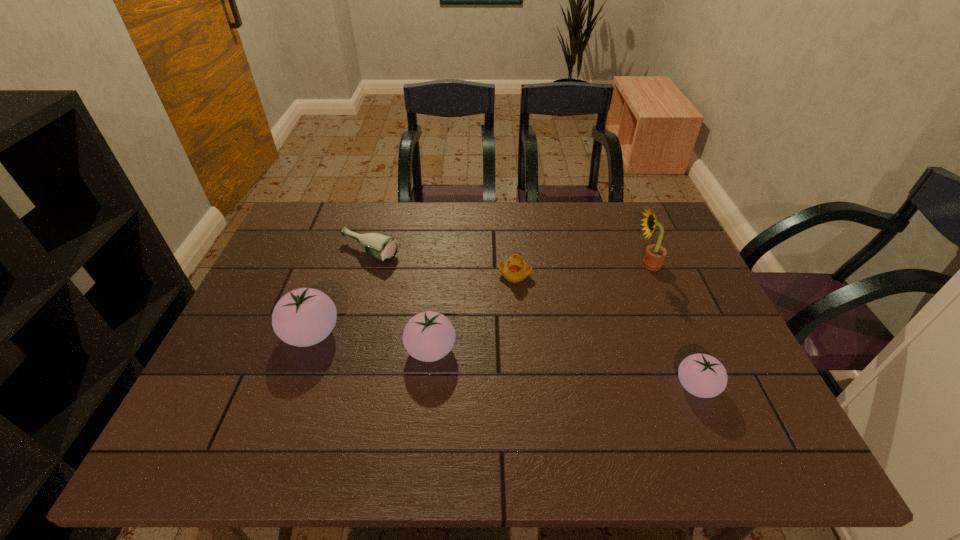
Please determine a free point for an extra tomato to ensure balance. Please provide its 2D coordinates. Your answer should be formatted as a tuple, i.e. [(x, y)], where the tuple contains the x and y coordinates of a point satisfying the conditions above.

[(559, 367)]